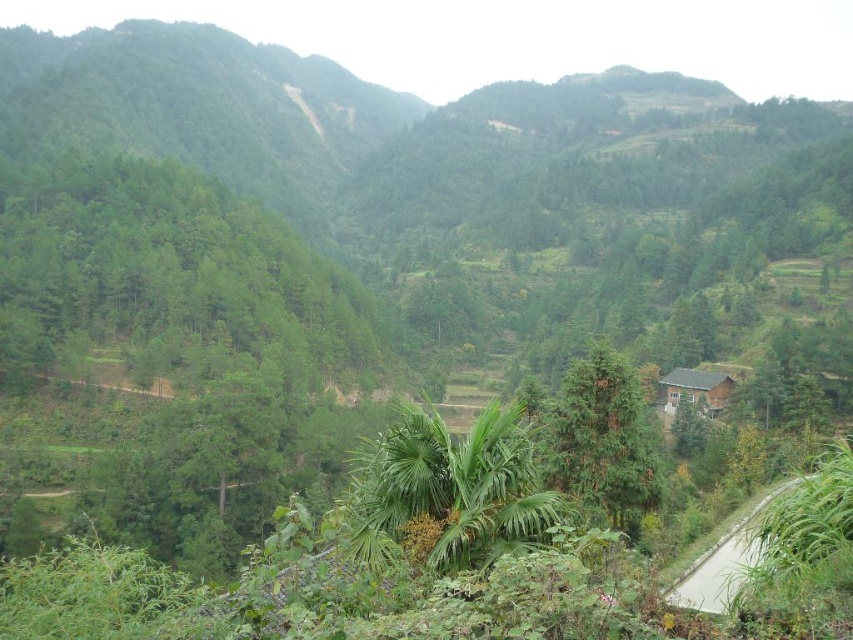
Does green matte tree at center have a larger size compared to brown wooden hut at center-right?

Yes.

Is green matte tree at center to the right of brown wooden hut at center-right from the viewer's perspective?

Incorrect, green matte tree at center is not on the right side of brown wooden hut at center-right.

The width and height of the screenshot is (853, 640). What are the coordinates of `green matte tree at center` in the screenshot? It's located at (602, 440).

Where is `green matte tree at center`? Image resolution: width=853 pixels, height=640 pixels. green matte tree at center is located at coordinates [x=602, y=440].

Does green leafy palm at center come in front of green matte tree at center?

Yes.

Looking at this image, is green leafy palm at center bigger than green matte tree at center?

Incorrect, green leafy palm at center is not larger than green matte tree at center.

Is point (531, 499) farther from camera compared to point (616, 456)?

No, (531, 499) is closer to viewer.

Locate an element on the screen. This screenshot has height=640, width=853. green leafy palm at center is located at coordinates (448, 486).

Between green leafy palm at center and brown wooden hut at center-right, which one has less height?

brown wooden hut at center-right is shorter.

In the scene shown: Does green leafy palm at center appear over brown wooden hut at center-right?

Incorrect, green leafy palm at center is not positioned above brown wooden hut at center-right.

Image resolution: width=853 pixels, height=640 pixels. Describe the element at coordinates (448, 486) in the screenshot. I see `green leafy palm at center` at that location.

Find the location of a particular element. The width and height of the screenshot is (853, 640). green leafy palm at center is located at coordinates (448, 486).